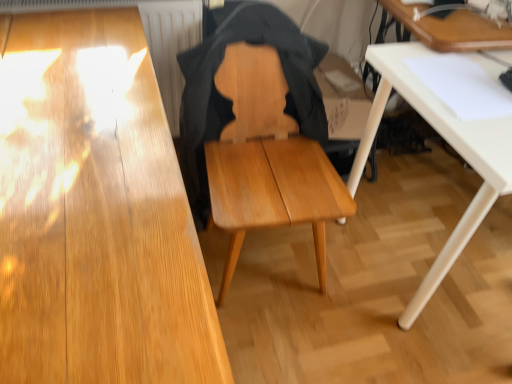
Question: Does white matte table at lower right, arranged as the 1th table when ordered from the bottom, touch wooden table at upper right, which is the first table from top to bottom?

Choices:
 (A) yes
 (B) no

Answer: (B)

Question: Does white matte table at lower right, arranged as the 1th table when ordered from the bottom, have a lesser height compared to wooden table at upper right, marked as the 2th table in a bottom-to-top arrangement?

Choices:
 (A) yes
 (B) no

Answer: (B)

Question: Is white matte table at lower right, arranged as the 1th table when ordered from the bottom, completely or partially outside of wooden table at upper right, which is the first table from top to bottom?

Choices:
 (A) no
 (B) yes

Answer: (B)

Question: From the image's perspective, is white matte table at lower right, positioned as the 2th table in top-to-bottom order, below wooden table at upper right, which is the first table from top to bottom?

Choices:
 (A) yes
 (B) no

Answer: (A)

Question: Would you say white matte table at lower right, arranged as the 1th table when ordered from the bottom, contains wooden table at upper right, which is the first table from top to bottom?

Choices:
 (A) no
 (B) yes

Answer: (A)

Question: Is point tap(393, 54) closer or farther from the camera than point tap(398, 13)?

Choices:
 (A) closer
 (B) farther

Answer: (A)

Question: From the image's perspective, is white matte table at lower right, arranged as the 1th table when ordered from the bottom, located above or below wooden table at upper right, which is the first table from top to bottom?

Choices:
 (A) below
 (B) above

Answer: (A)

Question: In the image, is white matte table at lower right, positioned as the 2th table in top-to-bottom order, positioned in front of or behind wooden table at upper right, which is the first table from top to bottom?

Choices:
 (A) behind
 (B) front

Answer: (B)

Question: Is white matte table at lower right, positioned as the 2th table in top-to-bottom order, taller or shorter than wooden table at upper right, marked as the 2th table in a bottom-to-top arrangement?

Choices:
 (A) tall
 (B) short

Answer: (A)

Question: Is point (499, 48) positioned closer to the camera than point (322, 157)?

Choices:
 (A) closer
 (B) farther

Answer: (A)

Question: Considering their positions, is wooden table at upper right, marked as the 2th table in a bottom-to-top arrangement, located in front of or behind light brown wood chair at center?

Choices:
 (A) behind
 (B) front

Answer: (A)

Question: In terms of height, does wooden table at upper right, which is the first table from top to bottom, look taller or shorter compared to light brown wood chair at center?

Choices:
 (A) short
 (B) tall

Answer: (A)

Question: Is wooden table at upper right, marked as the 2th table in a bottom-to-top arrangement, spatially inside light brown wood chair at center, or outside of it?

Choices:
 (A) inside
 (B) outside

Answer: (B)

Question: Considering their positions, is wooden table at upper right, marked as the 2th table in a bottom-to-top arrangement, located in front of or behind white matte table at lower right, positioned as the 2th table in top-to-bottom order?

Choices:
 (A) front
 (B) behind

Answer: (B)

Question: From the image's perspective, is wooden table at upper right, which is the first table from top to bottom, above or below white matte table at lower right, arranged as the 1th table when ordered from the bottom?

Choices:
 (A) below
 (B) above

Answer: (B)